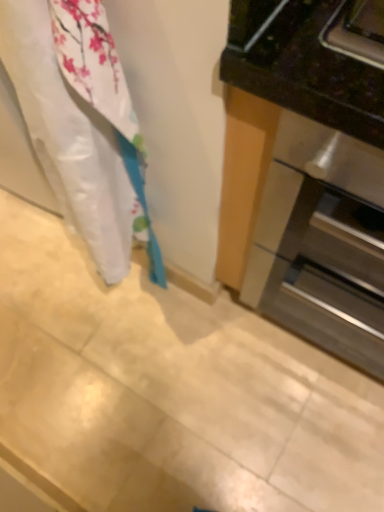
Locate an element on the screen. stainless steel oven at right is located at coordinates (x=317, y=168).

Measure the distance between point (244,32) and camera.

A distance of 18.66 inches exists between point (244,32) and camera.

What is the approximate height of stainless steel oven at right?

The height of stainless steel oven at right is 33.62 inches.

Describe the element at coordinates (317, 168) in the screenshot. I see `stainless steel oven at right` at that location.

I want to click on stainless steel oven at right, so click(x=317, y=168).